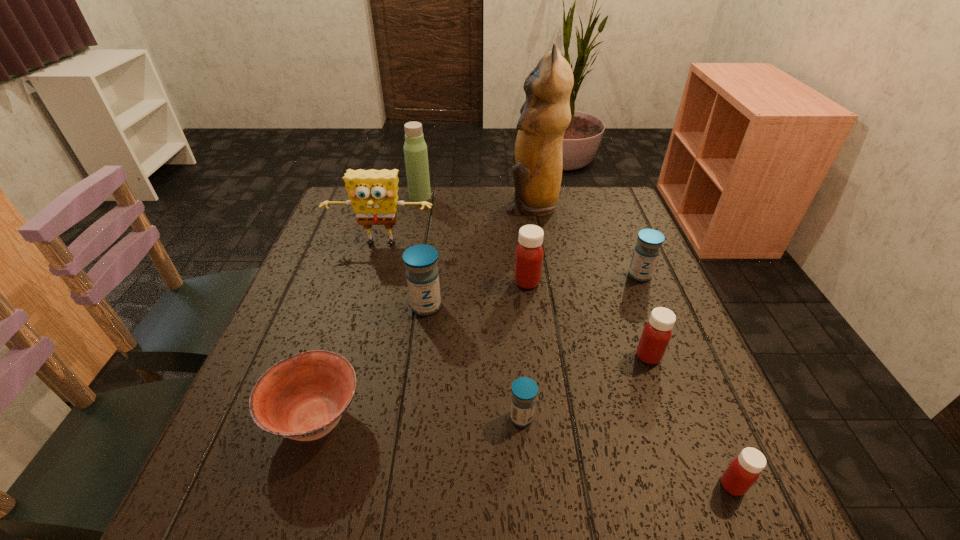
Locate an element on the screen. unoccupied position between the second nearest medicine and the farthest blue medicine is located at coordinates (581, 347).

Find the location of a particular element. The height and width of the screenshot is (540, 960). free spot between the leftmost red medicine and the light thermos bottle is located at coordinates (473, 239).

In order to click on free point between the leftmost red medicine and the nearest red medicine in this screenshot , I will do `click(630, 383)`.

Locate an element on the screen. unoccupied area between the rightmost red medicine and the bowl is located at coordinates (524, 452).

Find the location of a particular element. vacant area between the cat and the third farthest medicine is located at coordinates (479, 255).

Locate an element on the screen. unoccupied area between the second nearest medicine and the cat is located at coordinates (527, 310).

At what (x,y) coordinates should I click in order to perform the action: click on free space between the tallest object and the eighth nearest object. Please return your answer as a coordinate pair (x, y). This screenshot has height=540, width=960. Looking at the image, I should click on (457, 224).

Identify the location of free space between the second nearest medicine and the eighth nearest object. The image size is (960, 540). (451, 332).

Locate an element on the screen. The height and width of the screenshot is (540, 960). object that is the fourth closest to the second smallest red medicine is located at coordinates (529, 253).

Identify which object is located as the third nearest to the leftmost blue medicine. Please provide its 2D coordinates. Your answer should be formatted as a tuple, i.e. [(x, y)], where the tuple contains the x and y coordinates of a point satisfying the conditions above.

[(302, 397)]